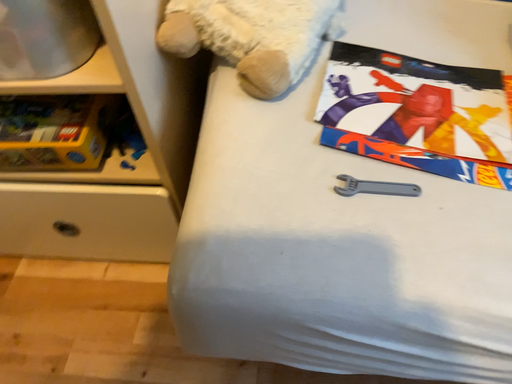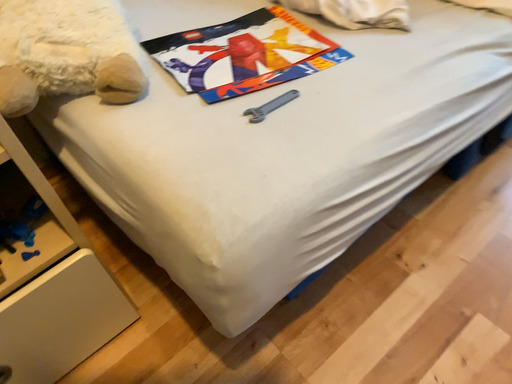
Question: How did the camera likely rotate when shooting the video?

Choices:
 (A) rotated right
 (B) rotated left

Answer: (A)